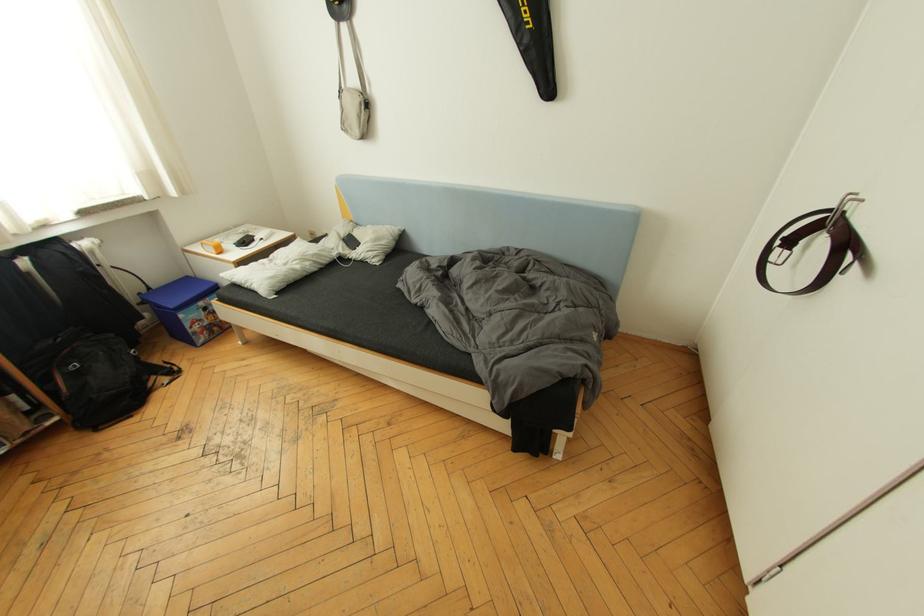
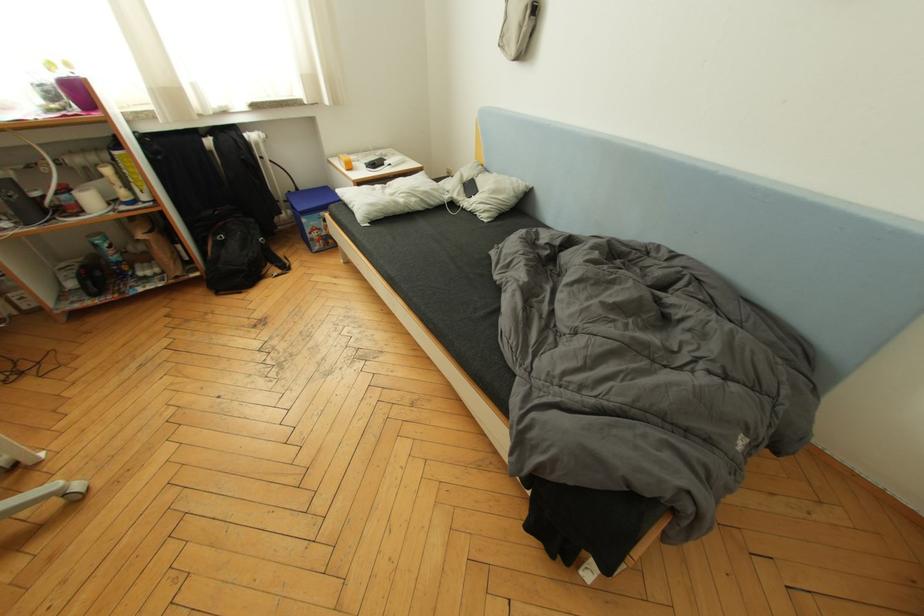
Question: The camera is either moving clockwise (left) or counter-clockwise (right) around the object. The first image is from the beginning of the video and the second image is from the end. Is the camera moving left or right when shooting the video?

Choices:
 (A) Left
 (B) Right

Answer: (B)